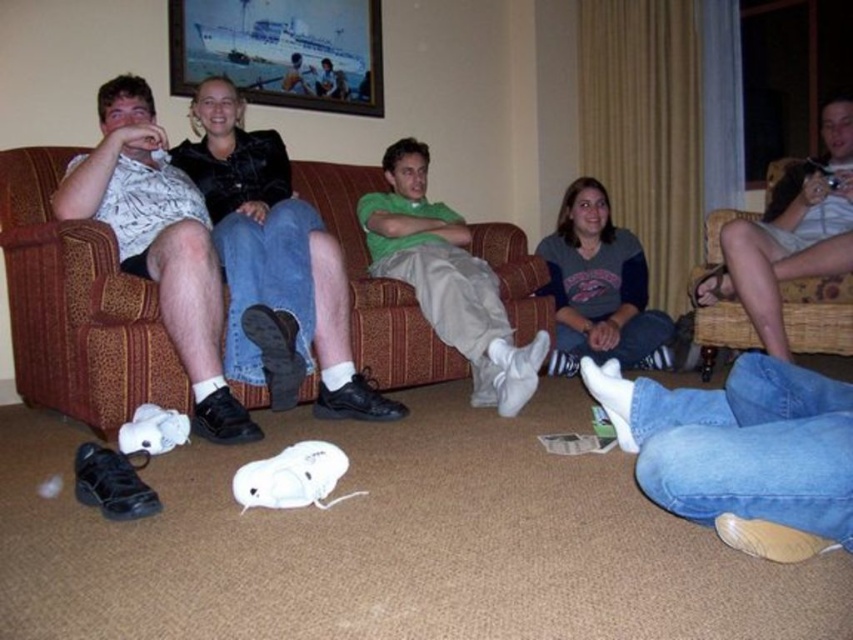
Between point (358, 292) and point (106, 195), which one is positioned in front?

Point (106, 195) is in front.

Is point (36, 387) closer to camera compared to point (102, 99)?

No, it is not.

Identify the location of brown fabric couch at center. This screenshot has width=853, height=640. (77, 307).

Is white matte sneakers at lower left above light brown wicker chair at right?

Actually, white matte sneakers at lower left is below light brown wicker chair at right.

Between point (820, 429) and point (788, 244), which one is positioned behind?

Point (788, 244)

The height and width of the screenshot is (640, 853). Find the location of `white matte sneakers at lower left`. white matte sneakers at lower left is located at coordinates (721, 477).

From the picture: Which is more to the right, matte black sneakers at left or green matte shirt at center?

green matte shirt at center is more to the right.

Can you confirm if matte black sneakers at left is shorter than green matte shirt at center?

Incorrect, matte black sneakers at left's height does not fall short of green matte shirt at center's.

Is point (196, 216) positioned behind point (399, 264)?

No.

Identify the location of matte black sneakers at left. (160, 243).